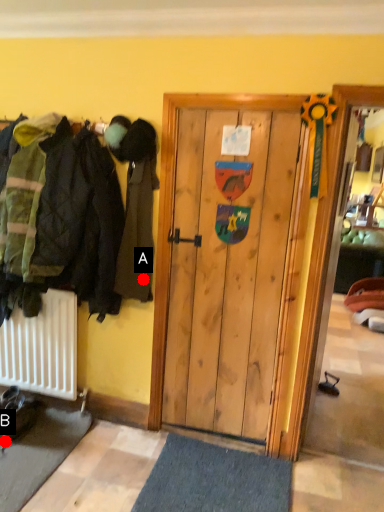
Question: Two points are circled on the image, labeled by A and B beside each circle. Which point is further to the camera?

Choices:
 (A) A is further
 (B) B is further

Answer: (B)